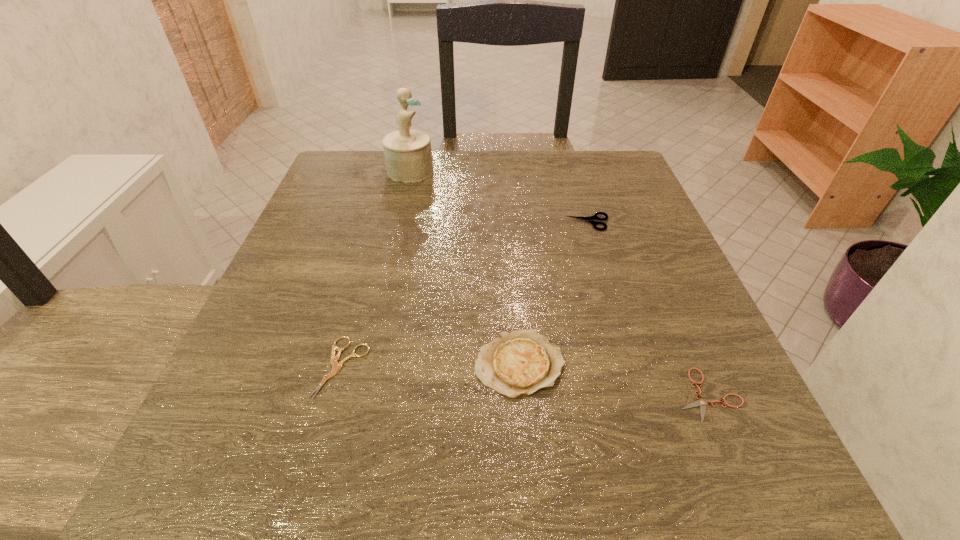
The width and height of the screenshot is (960, 540). In order to click on vacant region that satisfies the following two spatial constraints: 1. at the beak of the tallest object; 2. on the back side of the shortest object in this screenshot , I will do `click(359, 395)`.

The image size is (960, 540). Find the location of `vacant space that satisfies the following two spatial constraints: 1. at the beak of the rightmost shears; 2. on the left side of the farthest object`. vacant space that satisfies the following two spatial constraints: 1. at the beak of the rightmost shears; 2. on the left side of the farthest object is located at coordinates (359, 395).

Where is `vacant point that satisfies the following two spatial constraints: 1. on the back side of the third object from left to right; 2. on the left side of the fourth tallest object`? This screenshot has height=540, width=960. vacant point that satisfies the following two spatial constraints: 1. on the back side of the third object from left to right; 2. on the left side of the fourth tallest object is located at coordinates (344, 364).

The image size is (960, 540). What are the coordinates of `vacant position in the image that satisfies the following two spatial constraints: 1. at the beak of the farthest object; 2. on the back side of the quiche` in the screenshot? It's located at (366, 364).

The image size is (960, 540). In order to click on vacant area that satisfies the following two spatial constraints: 1. at the beak of the tallest object; 2. on the back side of the shortest shears in this screenshot , I will do 359,395.

In order to click on free region that satisfies the following two spatial constraints: 1. at the beak of the tallest object; 2. on the back side of the quiche in this screenshot , I will do `click(366, 364)`.